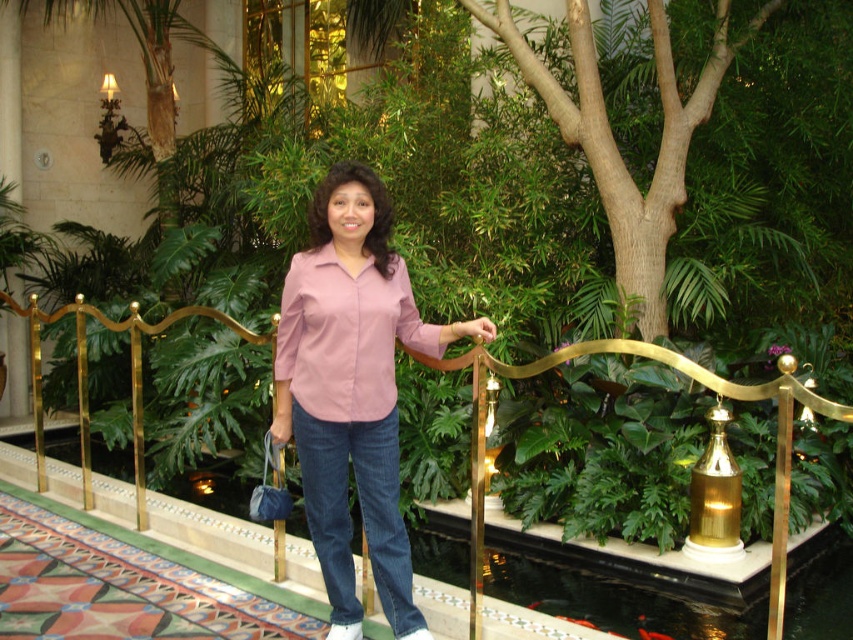
You are standing at the point with coordinates point (556, 362) and want to walk to the point with coordinates point (297, 339). Which direction should you move in relation to the points provided?

To move from point (556, 362) to point (297, 339), you should move towards the point (297, 339), which is behind point (556, 362) according to the spatial description.

Where is the pink satin blouse at center located in the image?

The pink satin blouse at center is located at point (352,388) in the image.